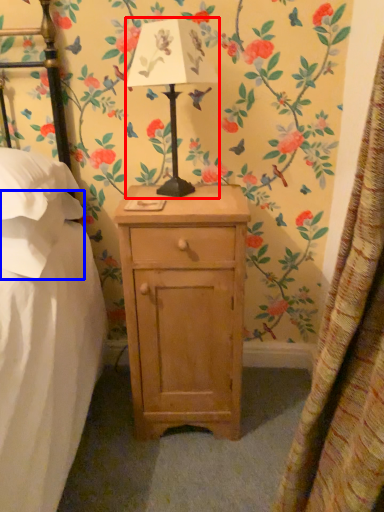
Question: Among these objects, which one is farthest to the camera, table lamp (highlighted by a red box) or pillow (highlighted by a blue box)?

Choices:
 (A) table lamp
 (B) pillow

Answer: (B)